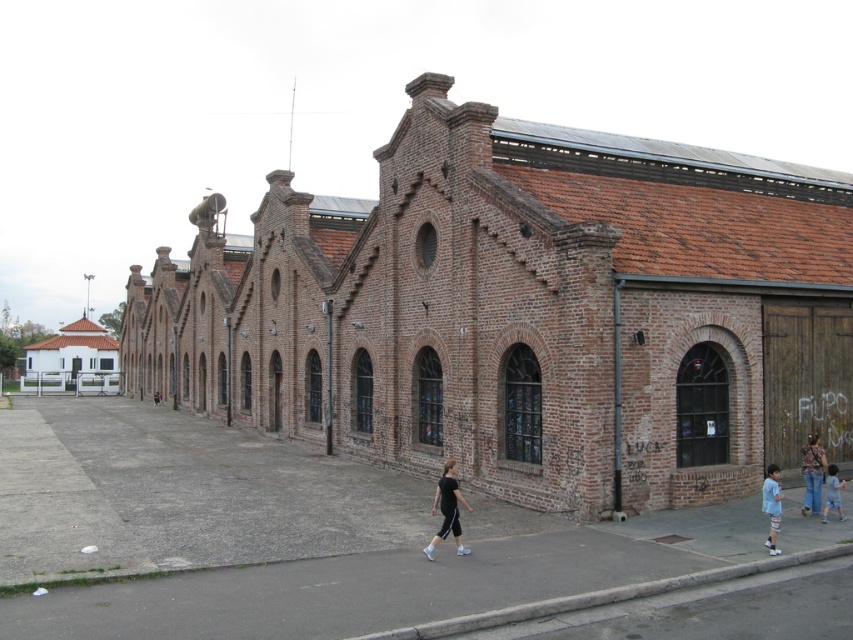
Question: In this image, where is brown brick alley at center located relative to light blue denim pants at lower right?

Choices:
 (A) below
 (B) above

Answer: (A)

Question: Which of the following is the closest to the observer?

Choices:
 (A) brown brick alley at center
 (B) light blue denim pants at lower right
 (C) light blue denim shorts at lower right
 (D) black matte pants at center

Answer: (A)

Question: Among these points, which one is farthest from the camera?

Choices:
 (A) (834, 486)
 (B) (752, 545)
 (C) (802, 474)
 (D) (773, 474)

Answer: (C)

Question: Can you confirm if patterned fabric shirt at lower right is positioned to the left of light blue denim shorts at lower right?

Choices:
 (A) yes
 (B) no

Answer: (B)

Question: Among these objects, which one is farthest from the camera?

Choices:
 (A) patterned fabric shirt at lower right
 (B) black matte pants at center
 (C) brown brick alley at center
 (D) light blue denim shorts at lower right

Answer: (A)

Question: Is black matte pants at center to the right of light blue denim shorts at lower right from the viewer's perspective?

Choices:
 (A) no
 (B) yes

Answer: (A)